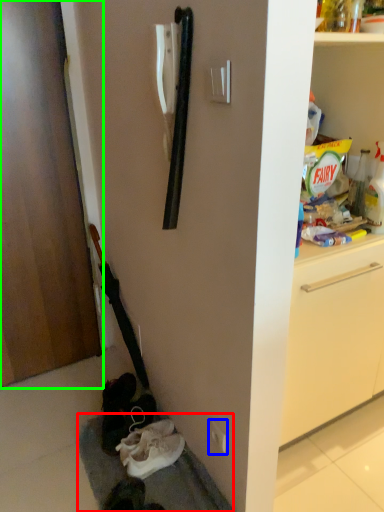
Question: Which object is positioned farthest from gray (highlighted by a red box)? Select from electric outlet (highlighted by a blue box) and door (highlighted by a green box).

Choices:
 (A) electric outlet
 (B) door

Answer: (B)